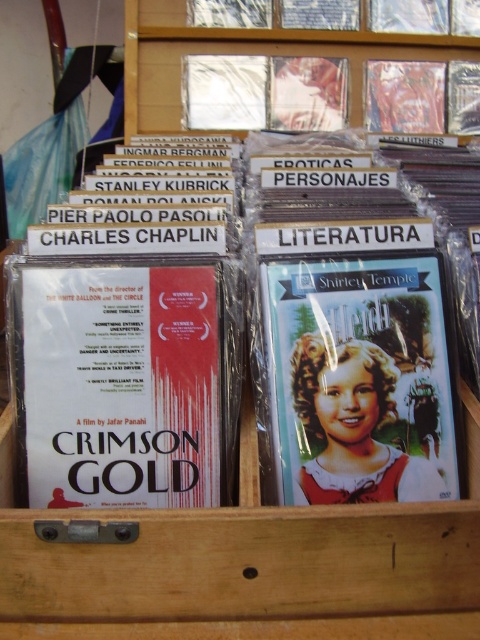
Question: Is white matte dvd case at center in front of matte plastic dvd at center?

Choices:
 (A) no
 (B) yes

Answer: (A)

Question: Is white matte dvd case at center above matte plastic dvd at center?

Choices:
 (A) no
 (B) yes

Answer: (A)

Question: In this image, where is white matte dvd case at center located relative to matte plastic dvd at center?

Choices:
 (A) above
 (B) below

Answer: (B)